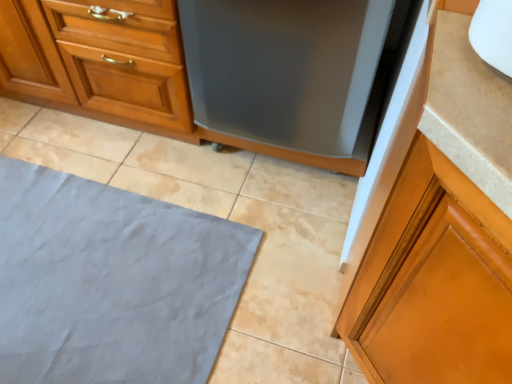
Question: Looking at their shapes, would you say gray fabric bath mat at lower left is wider or thinner than satin black dishwasher at center?

Choices:
 (A) wide
 (B) thin

Answer: (A)

Question: Considering the relative positions of gray fabric bath mat at lower left and satin black dishwasher at center in the image provided, is gray fabric bath mat at lower left to the left or to the right of satin black dishwasher at center?

Choices:
 (A) left
 (B) right

Answer: (A)

Question: Estimate the real-world distances between objects in this image. Which object is closer to the satin black dishwasher at center?

Choices:
 (A) glossy wood cabinet at right, the first cabinetry positioned from the front
 (B) wooden cabinet at center, acting as the first cabinetry starting from the top
 (C) gray fabric bath mat at lower left

Answer: (B)

Question: Considering the real-world distances, which object is farthest from the satin black dishwasher at center?

Choices:
 (A) gray fabric bath mat at lower left
 (B) wooden cabinet at center, which appears as the 1th cabinetry when viewed from the left
 (C) glossy wood cabinet at right, the 1th cabinetry positioned from the bottom

Answer: (C)